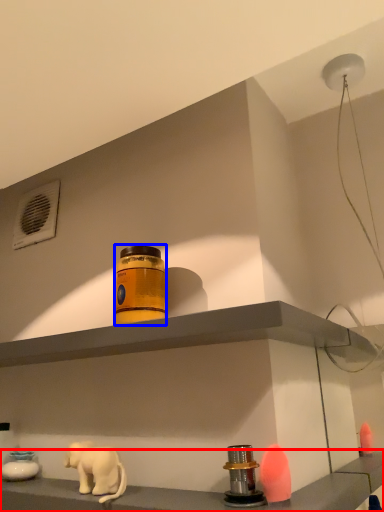
Question: Among these objects, which one is farthest to the camera, shelf (highlighted by a red box) or bottle (highlighted by a blue box)?

Choices:
 (A) shelf
 (B) bottle

Answer: (B)